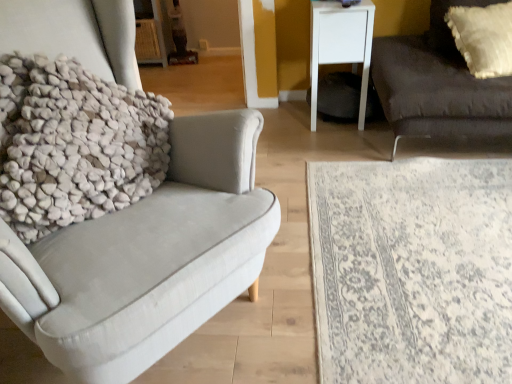
Question: Is dark gray fabric couch at right behind white textured rug at lower right?

Choices:
 (A) no
 (B) yes

Answer: (B)

Question: Is dark gray fabric couch at right shorter than white textured rug at lower right?

Choices:
 (A) yes
 (B) no

Answer: (B)

Question: Does dark gray fabric couch at right touch white textured rug at lower right?

Choices:
 (A) no
 (B) yes

Answer: (A)

Question: Considering the relative positions of dark gray fabric couch at right and white textured rug at lower right in the image provided, is dark gray fabric couch at right to the right of white textured rug at lower right from the viewer's perspective?

Choices:
 (A) no
 (B) yes

Answer: (B)

Question: From a real-world perspective, is dark gray fabric couch at right below white textured rug at lower right?

Choices:
 (A) yes
 (B) no

Answer: (B)

Question: Is white matte side table at upper right wider or thinner than white textured pillow at upper right?

Choices:
 (A) thin
 (B) wide

Answer: (B)

Question: Is white matte side table at upper right bigger or smaller than white textured pillow at upper right?

Choices:
 (A) small
 (B) big

Answer: (B)

Question: Considering their positions, is white matte side table at upper right located in front of or behind white textured pillow at upper right?

Choices:
 (A) front
 (B) behind

Answer: (B)

Question: Which is correct: white matte side table at upper right is inside white textured pillow at upper right, or outside of it?

Choices:
 (A) outside
 (B) inside

Answer: (A)

Question: Looking at their shapes, would you say dark gray fabric couch at right is wider or thinner than white textured pillow at upper right?

Choices:
 (A) wide
 (B) thin

Answer: (A)

Question: Is dark gray fabric couch at right inside the boundaries of white textured pillow at upper right, or outside?

Choices:
 (A) outside
 (B) inside

Answer: (A)

Question: From the image's perspective, is dark gray fabric couch at right located above or below white textured pillow at upper right?

Choices:
 (A) above
 (B) below

Answer: (B)

Question: Considering the positions of dark gray fabric couch at right and white textured pillow at upper right in the image, is dark gray fabric couch at right taller or shorter than white textured pillow at upper right?

Choices:
 (A) tall
 (B) short

Answer: (A)

Question: Is white textured rug at lower right spatially inside white textured pillow at left, or outside of it?

Choices:
 (A) outside
 (B) inside

Answer: (A)

Question: Considering the positions of white textured rug at lower right and white textured pillow at left in the image, is white textured rug at lower right wider or thinner than white textured pillow at left?

Choices:
 (A) wide
 (B) thin

Answer: (A)